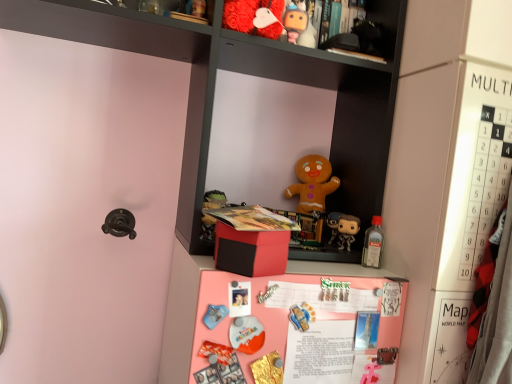
Where is `vacant area that is in front of translucent plastic bottle at upper right, the third toy when ordered from back to front`? vacant area that is in front of translucent plastic bottle at upper right, the third toy when ordered from back to front is located at coordinates (377, 278).